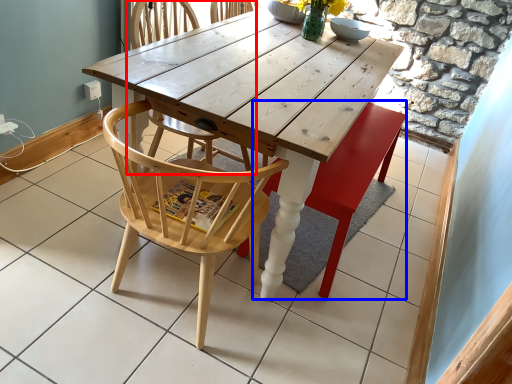
Question: Which point is closer to the camera, chair (highlighted by a red box) or swivel chair (highlighted by a blue box)?

Choices:
 (A) chair
 (B) swivel chair

Answer: (A)